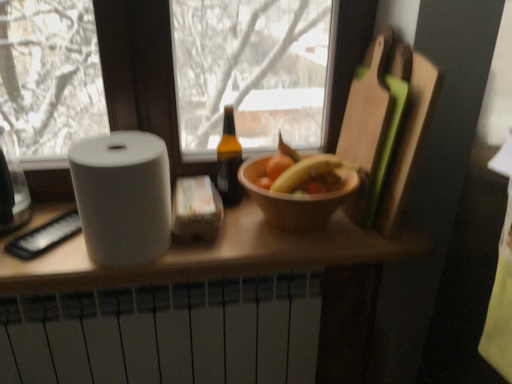
The image size is (512, 384). I want to click on empty space that is ontop of wooden bowl at center (from a real-world perspective), so click(283, 174).